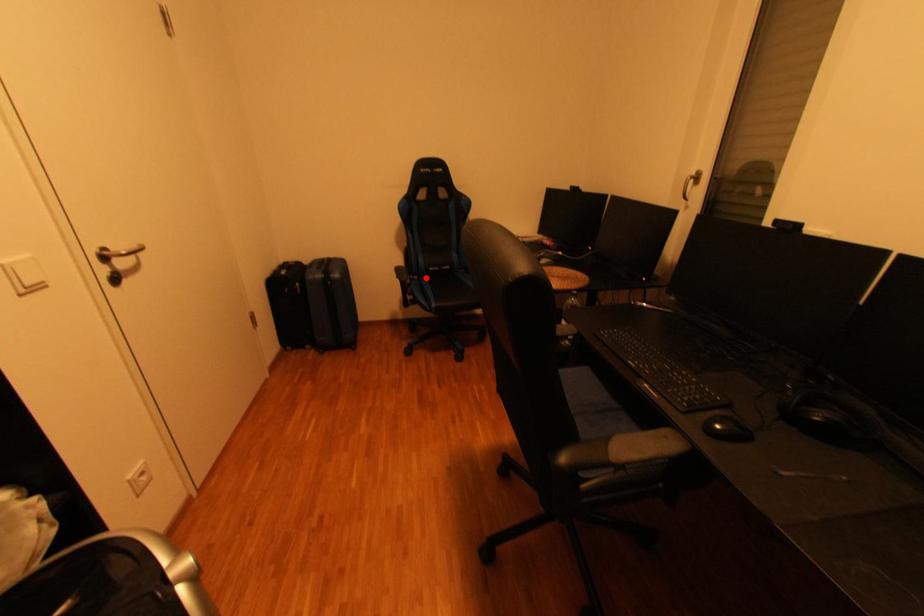
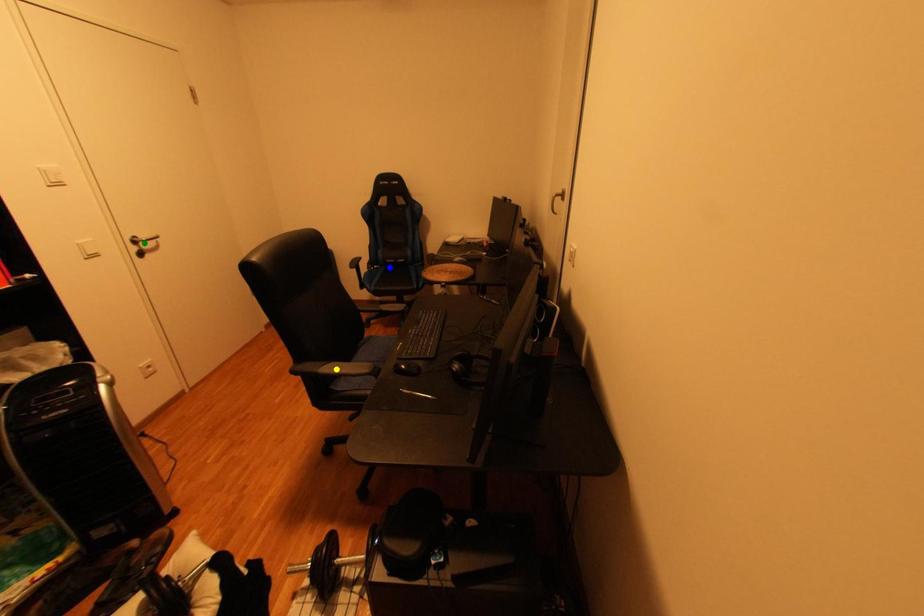
Question: I am providing you with two images of the same scene from different viewpoints. A red point is marked on the first image. You are given multiple points on the second image. In image 2, which mark is for the same physical point as the one in image 1?

Choices:
 (A) yellow point
 (B) blue point
 (C) green point

Answer: (B)